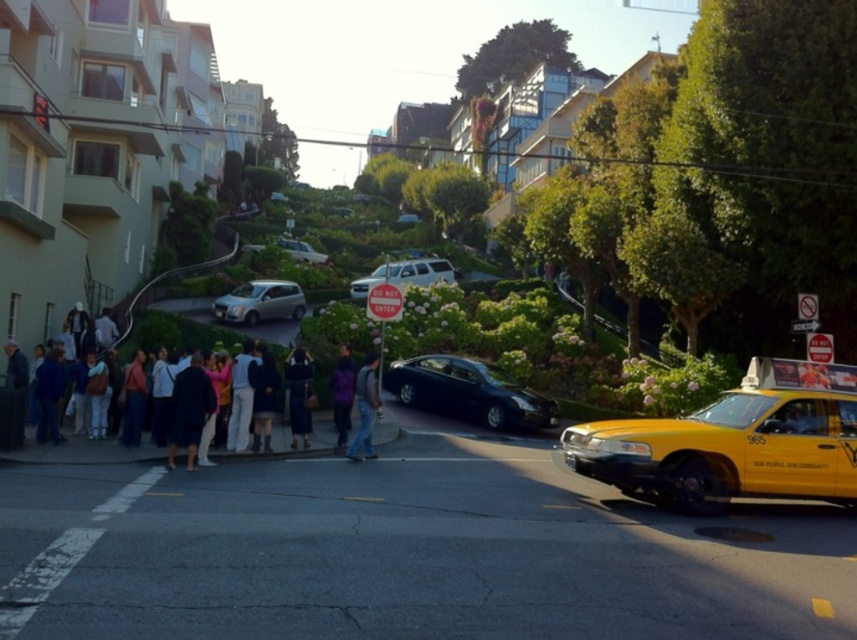
You are a delivery person trying to park your motorcycle between the satin silver car at center and the satin silver SUV at center. Your motorcycle is 1.8 meters wide. Can you fit your motorcycle between them?

The satin silver car at center is thinner than the satin silver SUV at center, but the exact distance between them isn not provided. Without knowing the space between the two vehicles, it is impossible to determine if the motorcycle will fit.

You are a pedestrian standing at the curb in the scene. You see a satin silver suv at center and denim jeans at center. How far apart are these two objects?

The distance between the satin silver suv at center and the denim jeans at center is 20.90 meters.

You are a pedestrian standing at the intersection and want to cross the street to reach the silver metallic car at center. Is the dark fabric coat at lower left blocking your path?

The dark fabric coat at lower left is closer to the viewer than the silver metallic car at center, so the dark fabric coat at lower left is blocking your path.